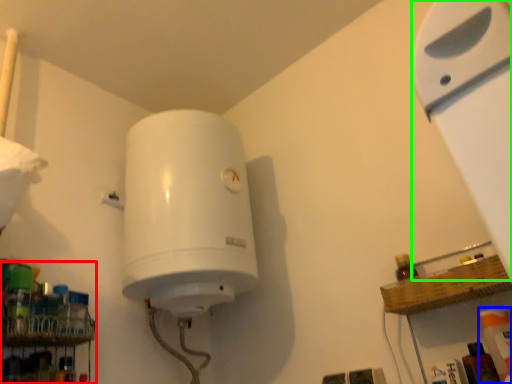
Question: Which is farther away from shelf (highlighted by a red box)? cleaning product (highlighted by a blue box) or wide (highlighted by a green box)?

Choices:
 (A) cleaning product
 (B) wide

Answer: (B)